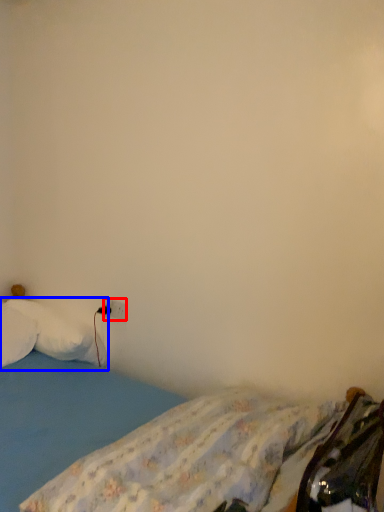
Question: Which object appears farthest to the camera in this image, electric outlet (highlighted by a red box) or pillow (highlighted by a blue box)?

Choices:
 (A) electric outlet
 (B) pillow

Answer: (A)